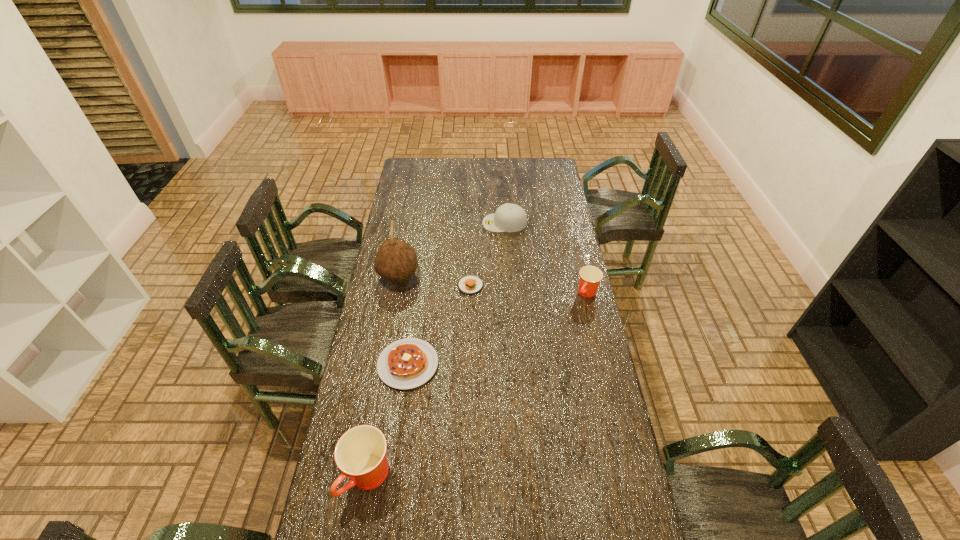
The width and height of the screenshot is (960, 540). I want to click on blank area in the image that satisfies the following two spatial constraints: 1. on the surface of the coconut; 2. on the back side of the food, so click(x=397, y=286).

Where is `vacant area in the image that satisfies the following two spatial constraints: 1. on the surface of the tallest object; 2. on the right side of the right cup`? The width and height of the screenshot is (960, 540). vacant area in the image that satisfies the following two spatial constraints: 1. on the surface of the tallest object; 2. on the right side of the right cup is located at coordinates (396, 293).

Locate an element on the screen. This screenshot has height=540, width=960. free space in the image that satisfies the following two spatial constraints: 1. on the surface of the coconut; 2. on the left side of the food is located at coordinates (397, 286).

Identify the location of vacant region that satisfies the following two spatial constraints: 1. on the back side of the shorter cup; 2. on the surface of the coconut. (584, 277).

Locate an element on the screen. The width and height of the screenshot is (960, 540). vacant point that satisfies the following two spatial constraints: 1. on the front side of the shortest object; 2. on the right side of the rightmost object is located at coordinates (470, 293).

Locate an element on the screen. vacant region that satisfies the following two spatial constraints: 1. on the front-facing side of the farthest object; 2. on the back side of the right cup is located at coordinates (509, 293).

Locate an element on the screen. This screenshot has height=540, width=960. free spot that satisfies the following two spatial constraints: 1. on the front-facing side of the cap; 2. on the front side of the shortest object is located at coordinates (509, 286).